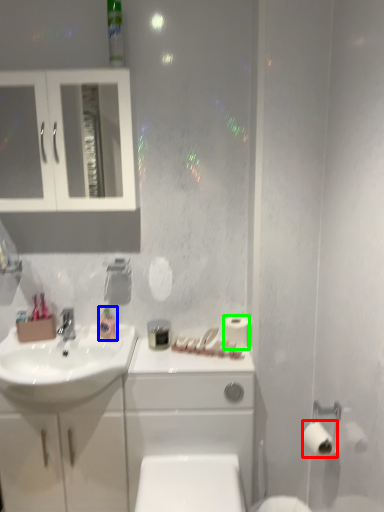
Question: Based on their relative distances, which object is nearer to toilet paper (highlighted by a red box)? Choose from mouthwash (highlighted by a blue box) and toilet paper (highlighted by a green box).

Choices:
 (A) mouthwash
 (B) toilet paper

Answer: (B)